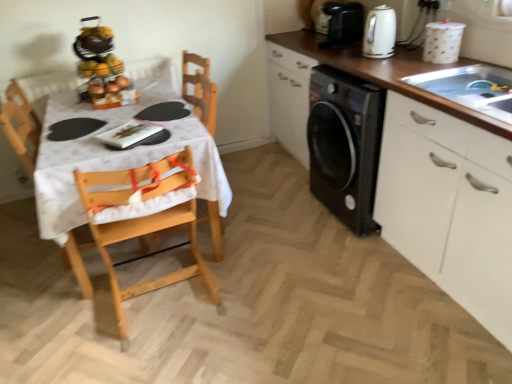
Where is `unoccupied area in front of white glossy canister at upper right, which ranks as the second appliance in back-to-front order`? This screenshot has height=384, width=512. unoccupied area in front of white glossy canister at upper right, which ranks as the second appliance in back-to-front order is located at coordinates 445,71.